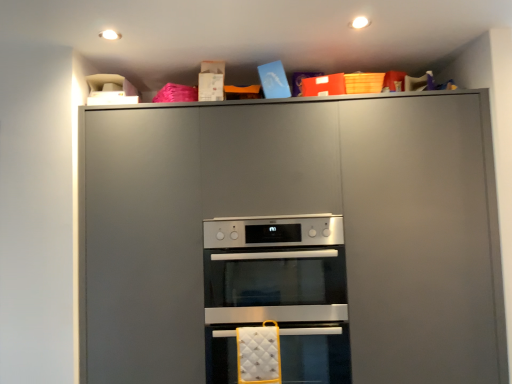
Question: Considering the relative positions of satin silver oven at center, placed as the 2th oven when sorted from bottom to top, and matte gray cabinet at upper center in the image provided, is satin silver oven at center, placed as the 2th oven when sorted from bottom to top, to the left or to the right of matte gray cabinet at upper center?

Choices:
 (A) right
 (B) left

Answer: (B)

Question: From the image's perspective, is satin silver oven at center, positioned as the first oven in top-to-bottom order, positioned above or below matte gray cabinet at upper center?

Choices:
 (A) above
 (B) below

Answer: (B)

Question: Which is nearer to the satin silver oven at center, positioned as the first oven in top-to-bottom order?

Choices:
 (A) silver metallic oven at center, which is the first oven from bottom to top
 (B) matte gray cabinet at upper center

Answer: (A)

Question: Based on their relative distances, which object is nearer to the satin silver oven at center, positioned as the first oven in top-to-bottom order?

Choices:
 (A) matte gray cabinet at upper center
 (B) silver metallic oven at center, which is the first oven from bottom to top

Answer: (B)